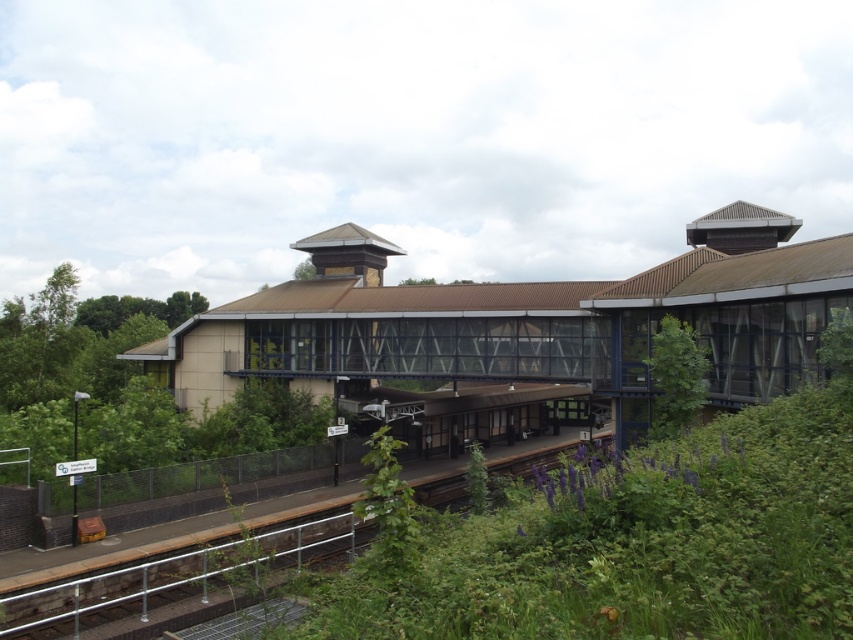
Question: Is brown textured building at center positioned at the back of metallic rail at lower center?

Choices:
 (A) no
 (B) yes

Answer: (B)

Question: Is brown textured building at center above metallic rail at lower center?

Choices:
 (A) no
 (B) yes

Answer: (B)

Question: Which of the following is the closest to the observer?

Choices:
 (A) brown textured building at center
 (B) metallic rail at lower center

Answer: (B)

Question: Which of the following is the closest to the observer?

Choices:
 (A) (361, 275)
 (B) (320, 520)

Answer: (B)

Question: Is brown textured building at center smaller than metallic rail at lower center?

Choices:
 (A) no
 (B) yes

Answer: (A)